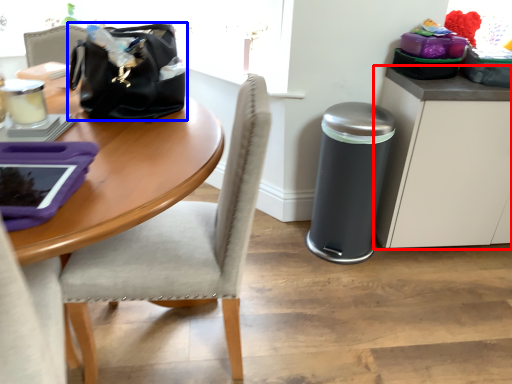
Question: Which of the following is the farthest to the observer, cabinetry (highlighted by a red box) or handbag (highlighted by a blue box)?

Choices:
 (A) cabinetry
 (B) handbag

Answer: (A)